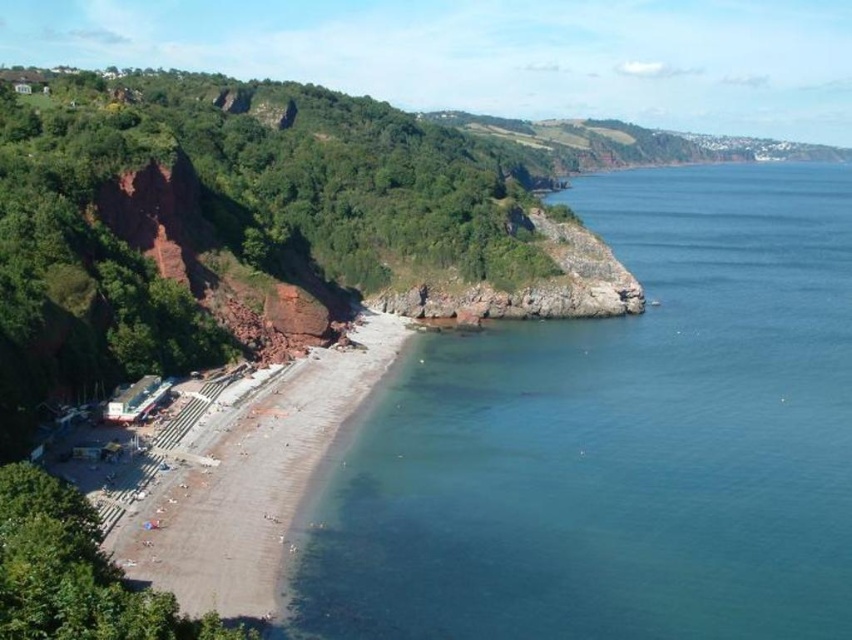
You are standing at the edge of the cliff overlooking the beach in the coastal scene. You notice two points marked on the image. Which point, point (781, 438) or point (348, 358), is closer to your current position?

Point (781, 438) is closer to the camera than point (348, 358), so it is closer to your current position on the cliff.